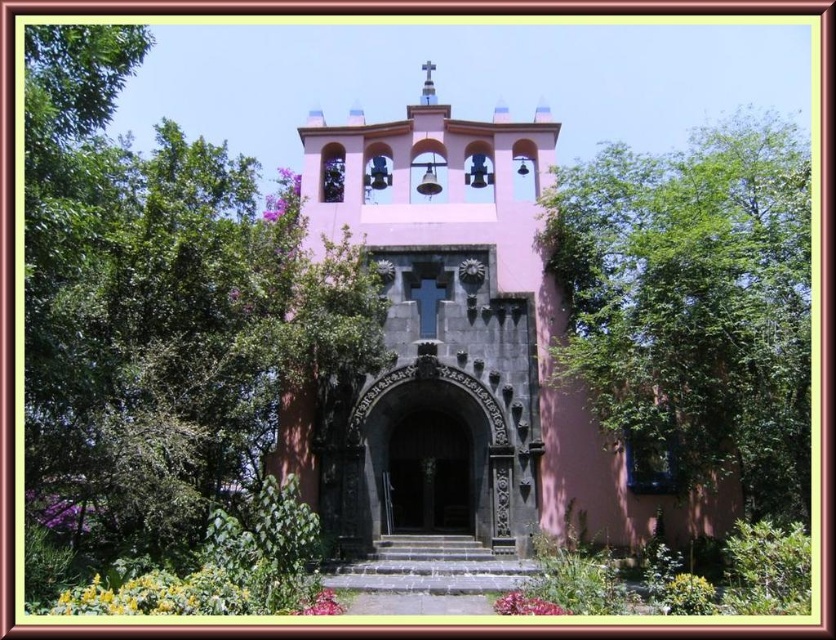
Question: Does pink matte church at center have a smaller size compared to black polished wood door at center?

Choices:
 (A) no
 (B) yes

Answer: (A)

Question: Can you confirm if pink matte church at center is smaller than green leafy tree at upper right?

Choices:
 (A) yes
 (B) no

Answer: (B)

Question: Which point is closer to the camera?

Choices:
 (A) (467, 493)
 (B) (599, 346)

Answer: (B)

Question: Is green leafy tree at center to the left of black polished wood door at center from the viewer's perspective?

Choices:
 (A) yes
 (B) no

Answer: (A)

Question: Which object is the farthest from the pink matte church at center?

Choices:
 (A) black polished wood door at center
 (B) green leafy tree at upper right

Answer: (B)

Question: Which point is farther to the camera?

Choices:
 (A) green leafy tree at center
 (B) green leafy tree at upper right
 (C) black polished wood door at center

Answer: (C)